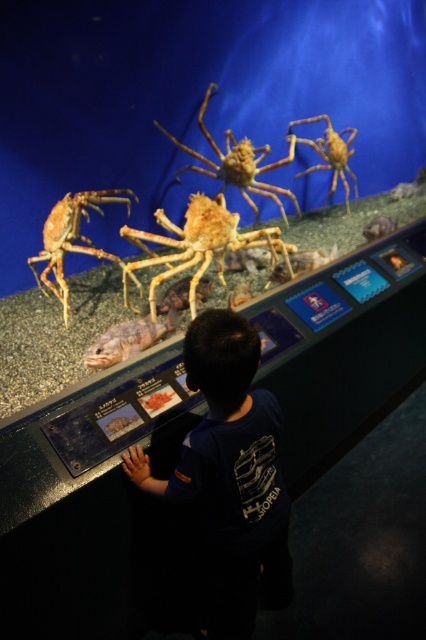
Question: Does yellowish matte spider at center have a smaller size compared to matte orange crab at left?

Choices:
 (A) yes
 (B) no

Answer: (A)

Question: Does golden textured crab at center have a smaller size compared to smooth orange crab at upper right?

Choices:
 (A) no
 (B) yes

Answer: (A)

Question: Which point is closer to the camera?

Choices:
 (A) smooth orange crab at upper right
 (B) dark blue t-shirt at center

Answer: (B)

Question: Which object appears closest to the camera in this image?

Choices:
 (A) golden textured crab at center
 (B) smooth orange crab at upper right
 (C) yellowish matte spider at center

Answer: (C)

Question: Which is nearer to the yellowish matte spider at center?

Choices:
 (A) smooth orange crab at upper right
 (B) brown textured fish at center
 (C) dark blue t-shirt at center

Answer: (B)

Question: Does dark blue t-shirt at center have a lesser width compared to brown textured fish at center?

Choices:
 (A) no
 (B) yes

Answer: (A)